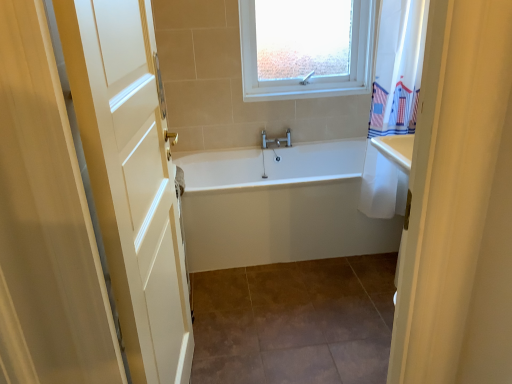
Describe the element at coordinates (131, 178) in the screenshot. I see `white wood door at left` at that location.

The width and height of the screenshot is (512, 384). What are the coordinates of `brown tile at center` in the screenshot? It's located at (295, 322).

Locate an element on the screen. white wood door at left is located at coordinates (131, 178).

Which object is wider, brown tile at center or white glossy bathtub at center?

brown tile at center.

Between brown tile at center and white glossy bathtub at center, which one appears on the left side from the viewer's perspective?

From the viewer's perspective, white glossy bathtub at center appears more on the left side.

Is white glossy bathtub at center surrounded by brown tile at center?

That's incorrect, white glossy bathtub at center is not inside brown tile at center.

Is white plastic window at upper center far from white glossy bathtub at center?

Yes.

Is white plastic window at upper center to the left or to the right of white glossy bathtub at center in the image?

white plastic window at upper center is positioned on white glossy bathtub at center's right side.

Locate an element on the screen. This screenshot has height=384, width=512. window that appears behind the white glossy bathtub at center is located at coordinates (315, 75).

Considering the sizes of white plastic window at upper center and white glossy bathtub at center in the image, is white plastic window at upper center taller or shorter than white glossy bathtub at center?

white plastic window at upper center is taller than white glossy bathtub at center.

Between white wood door at left and white glossy bathtub at center, which one appears on the right side from the viewer's perspective?

Positioned to the right is white glossy bathtub at center.

Does white wood door at left turn towards white glossy bathtub at center?

No, white wood door at left is not turned towards white glossy bathtub at center.

Is white wood door at left in front of or behind white glossy bathtub at center in the image?

white wood door at left is in front of white glossy bathtub at center.

From the image's perspective, who appears lower, white wood door at left or white glossy bathtub at center?

white wood door at left is shown below in the image.

From the image's perspective, between white glossy bathtub at center and white wood door at left, which one is located above?

white glossy bathtub at center.

Between white glossy bathtub at center and white wood door at left, which one appears on the left side from the viewer's perspective?

From the viewer's perspective, white wood door at left appears more on the left side.

Find the location of a particular element. bathtub on the right of the white wood door at left is located at coordinates (279, 206).

From a real-world perspective, is white glossy bathtub at center under white wood door at left?

Yes, from a real-world perspective, white glossy bathtub at center is beneath white wood door at left.

Consider the image. In the image, is white wood door at left positioned in front of or behind brown tile at center?

Visually, white wood door at left is located in front of brown tile at center.

Locate an element on the screen. This screenshot has height=384, width=512. tile lying behind the white wood door at left is located at coordinates (295, 322).

Are white wood door at left and brown tile at center beside each other?

white wood door at left is not next to brown tile at center, and they're not touching.

Is brown tile at center inside white wood door at left?

No, white wood door at left does not contain brown tile at center.

Considering the sizes of objects white glossy bathtub at center and white plastic window at upper center in the image provided, who is taller, white glossy bathtub at center or white plastic window at upper center?

white plastic window at upper center.

Does point (405, 194) appear closer or farther from the camera than point (242, 53)?

Point (405, 194) is positioned closer to the camera compared to point (242, 53).

Would you say white glossy bathtub at center is inside or outside white plastic window at upper center?

white glossy bathtub at center cannot be found inside white plastic window at upper center.

Is white glossy bathtub at center not near white plastic window at upper center?

white glossy bathtub at center is positioned a significant distance from white plastic window at upper center.

How many degrees apart are the facing directions of white wood door at left and white plastic window at upper center?

83.8 degrees separate the facing orientations of white wood door at left and white plastic window at upper center.

Is white wood door at left at the right side of white plastic window at upper center?

Incorrect, white wood door at left is not on the right side of white plastic window at upper center.

Is white wood door at left taller than white plastic window at upper center?

Yes, white wood door at left is taller than white plastic window at upper center.

Is white wood door at left beside white plastic window at upper center?

No.

Identify the location of tile that appears on the right of white glossy bathtub at center. This screenshot has width=512, height=384. (295, 322).

The height and width of the screenshot is (384, 512). Find the location of `bathtub located in front of the white plastic window at upper center`. bathtub located in front of the white plastic window at upper center is located at coordinates (279, 206).

Considering their positions, is brown tile at center positioned closer to white plastic window at upper center than white glossy bathtub at center?

white glossy bathtub at center.

When comparing their distances from brown tile at center, does white glossy bathtub at center or white wood door at left seem closer?

Among the two, white glossy bathtub at center is located nearer to brown tile at center.

From the image, which object appears to be nearer to white glossy bathtub at center, brown tile at center or white wood door at left?

brown tile at center.

Based on the photo, considering their positions, is white plastic window at upper center positioned further to white glossy bathtub at center than white wood door at left?

white plastic window at upper center is positioned further to the anchor white glossy bathtub at center.

Based on their spatial positions, is white wood door at left or white plastic window at upper center further from brown tile at center?

white plastic window at upper center is further to brown tile at center.

Looking at this image, considering their positions, is white wood door at left positioned further to white glossy bathtub at center than white plastic window at upper center?

white plastic window at upper center lies further to white glossy bathtub at center than the other object.

From the image, which object appears to be nearer to white glossy bathtub at center, brown tile at center or white plastic window at upper center?

brown tile at center is positioned closer to the anchor white glossy bathtub at center.

Based on their spatial positions, is white wood door at left or brown tile at center further from white glossy bathtub at center?

white wood door at left is positioned further to the anchor white glossy bathtub at center.

Find the location of a particular element. This screenshot has width=512, height=384. bathtub positioned between white wood door at left and white plastic window at upper center from near to far is located at coordinates (279, 206).

You are a GUI agent. You are given a task and a screenshot of the screen. Output one action in this format:
    pyautogui.click(x=<x>, y=<y>)
    Task: Click on the bathtub that lies between white plastic window at upper center and brown tile at center from top to bottom
    This screenshot has height=384, width=512.
    Given the screenshot: What is the action you would take?
    point(279,206)

The height and width of the screenshot is (384, 512). I want to click on tile between white wood door at left and white glossy bathtub at center along the z-axis, so click(295, 322).

Locate an element on the screen. Image resolution: width=512 pixels, height=384 pixels. tile between white wood door at left and white plastic window at upper center along the z-axis is located at coordinates (295, 322).